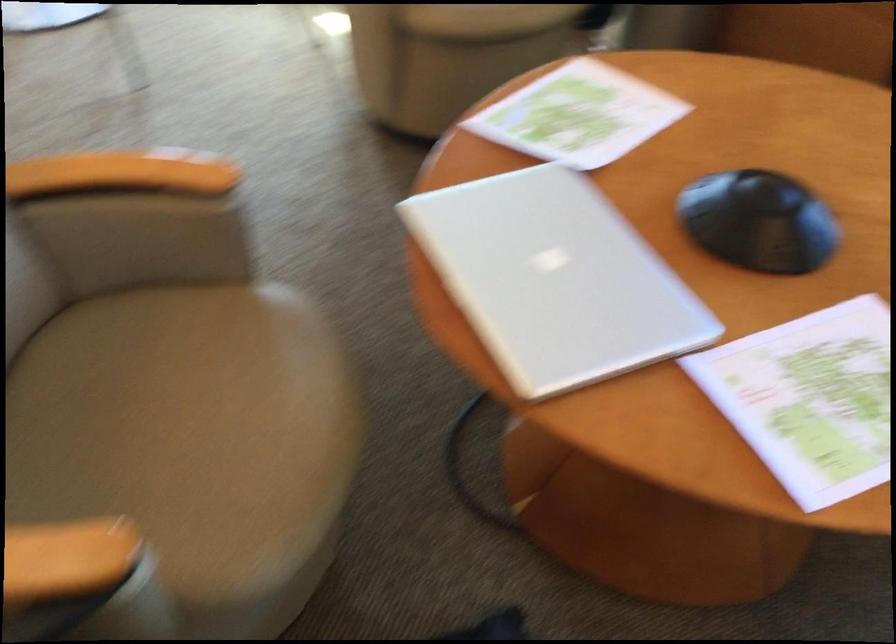
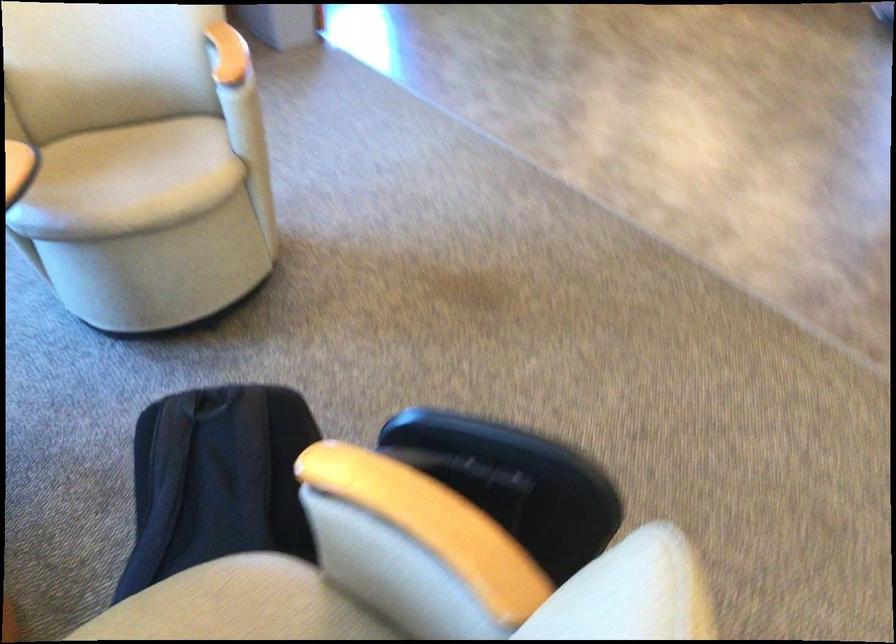
Question: I am providing you with two images of the same scene from different viewpoints. After the viewpoint changes to image2, which objects are now occluded?

Choices:
 (A) trolley handle
 (B) wooden chair armrest
 (C) brown chair armrest
 (D) chair sitting surface

Answer: (C)